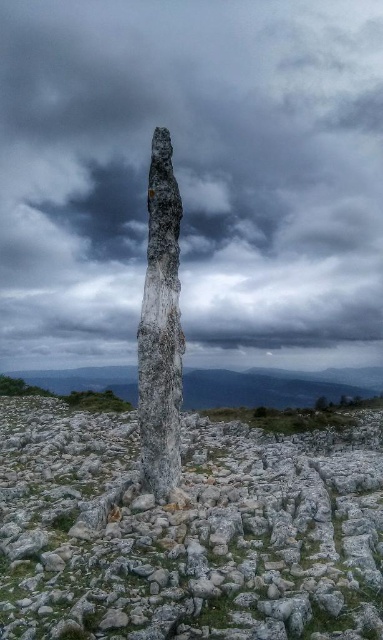
You are standing in a rugged landscape with a solitary stone. You notice a point marked at coordinates (193, 177). What does this point indicate?

The point at coordinates (193, 177) marks the gray cloudy sky at upper center.

You are an architect designing a new monument. You want to capture the essence of the scene in your design. Which object should you focus on to emphasize verticality, given the spatial relationship between the gray cloudy sky at upper center and the white stone pillar at center?

The white stone pillar at center should be emphasized to highlight verticality because the gray cloudy sky at upper center is much taller, creating a contrast in height between the two elements.